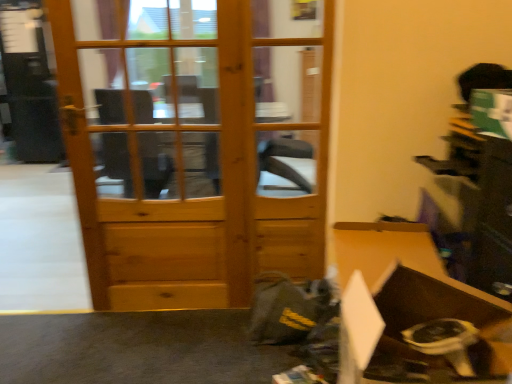
Question: Should I look upward or downward to see brown cardboard box at lower right?

Choices:
 (A) down
 (B) up

Answer: (A)

Question: Does natural wood door at left lie behind brown cardboard box at lower right?

Choices:
 (A) no
 (B) yes

Answer: (B)

Question: Is natural wood door at left taller than brown cardboard box at lower right?

Choices:
 (A) yes
 (B) no

Answer: (A)

Question: Are natural wood door at left and brown cardboard box at lower right located far from each other?

Choices:
 (A) no
 (B) yes

Answer: (B)

Question: Is natural wood door at left at the right side of brown cardboard box at lower right?

Choices:
 (A) no
 (B) yes

Answer: (A)

Question: Is natural wood door at left not inside brown cardboard box at lower right?

Choices:
 (A) yes
 (B) no

Answer: (A)

Question: From a real-world perspective, is natural wood door at left located beneath brown cardboard box at lower right?

Choices:
 (A) yes
 (B) no

Answer: (B)

Question: From the image's perspective, is brown cardboard box at lower right over natural wood door at left?

Choices:
 (A) yes
 (B) no

Answer: (B)

Question: Is brown cardboard box at lower right surrounding natural wood door at left?

Choices:
 (A) no
 (B) yes

Answer: (A)

Question: From the image's perspective, is brown cardboard box at lower right located beneath natural wood door at left?

Choices:
 (A) no
 (B) yes

Answer: (B)

Question: Is brown cardboard box at lower right positioned in front of natural wood door at left?

Choices:
 (A) no
 (B) yes

Answer: (B)

Question: Can you confirm if brown cardboard box at lower right is positioned to the left of natural wood door at left?

Choices:
 (A) no
 (B) yes

Answer: (A)

Question: Would you say brown cardboard box at lower right is outside natural wood door at left?

Choices:
 (A) yes
 (B) no

Answer: (A)

Question: Relative to natural wood door at left, is brown cardboard box at lower right in front or behind?

Choices:
 (A) behind
 (B) front

Answer: (B)